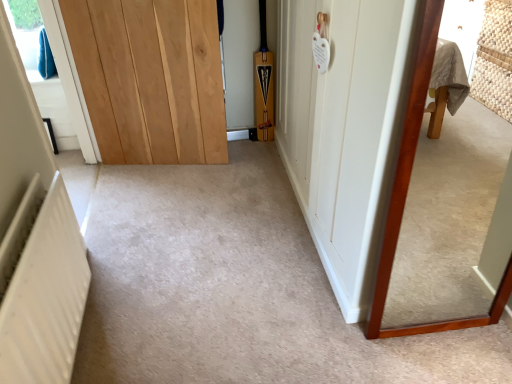
Question: Considering the relative positions of white textured radiator at lower left and wooden-framed mirror at right in the image provided, is white textured radiator at lower left in front of wooden-framed mirror at right?

Choices:
 (A) yes
 (B) no

Answer: (A)

Question: Is white textured radiator at lower left far away from wooden-framed mirror at right?

Choices:
 (A) yes
 (B) no

Answer: (A)

Question: From the image's perspective, is white textured radiator at lower left on top of wooden-framed mirror at right?

Choices:
 (A) yes
 (B) no

Answer: (B)

Question: Is white textured radiator at lower left wider than wooden-framed mirror at right?

Choices:
 (A) yes
 (B) no

Answer: (A)

Question: Is wooden-framed mirror at right located within white textured radiator at lower left?

Choices:
 (A) yes
 (B) no

Answer: (B)

Question: Based on their positions, is light brown wood door at center, the 1th door from the left, located to the left or right of white wood door at center, the first door from the right?

Choices:
 (A) right
 (B) left

Answer: (B)

Question: Is light brown wood door at center, the 1th door from the left, taller or shorter than white wood door at center, the first door from the right?

Choices:
 (A) short
 (B) tall

Answer: (A)

Question: Does point (202, 11) appear closer or farther from the camera than point (347, 160)?

Choices:
 (A) closer
 (B) farther

Answer: (B)

Question: Considering the positions of light brown wood door at center, the 1th door from the left, and white wood door at center, the first door from the right, in the image, is light brown wood door at center, the 1th door from the left, bigger or smaller than white wood door at center, the first door from the right,?

Choices:
 (A) small
 (B) big

Answer: (A)

Question: From the image's perspective, relative to white wood door at center, the first door from the right, is wooden-framed mirror at right above or below?

Choices:
 (A) above
 (B) below

Answer: (B)

Question: From a real-world perspective, relative to white wood door at center, which is the second door from left to right, is wooden-framed mirror at right vertically above or below?

Choices:
 (A) below
 (B) above

Answer: (A)

Question: In terms of width, does wooden-framed mirror at right look wider or thinner when compared to white wood door at center, the first door from the right?

Choices:
 (A) wide
 (B) thin

Answer: (B)

Question: Considering their positions, is wooden-framed mirror at right located in front of or behind white wood door at center, which is the second door from left to right?

Choices:
 (A) front
 (B) behind

Answer: (A)

Question: Considering the positions of point (49, 89) and point (68, 248), is point (49, 89) closer or farther from the camera than point (68, 248)?

Choices:
 (A) farther
 (B) closer

Answer: (A)

Question: From the image's perspective, relative to white textured radiator at lower left, is white plastic radiator at lower left above or below?

Choices:
 (A) above
 (B) below

Answer: (A)